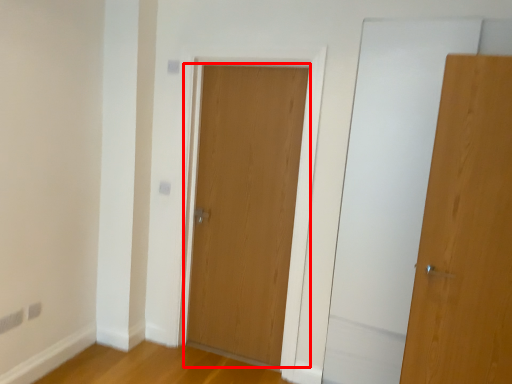
Question: In this image, where is door (annotated by the red box) located relative to door?

Choices:
 (A) right
 (B) left

Answer: (B)